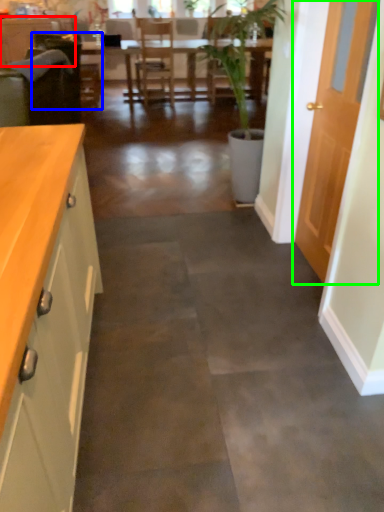
Question: Which is farther away from cabinetry (highlighted by a red box)? armchair (highlighted by a blue box) or door (highlighted by a green box)?

Choices:
 (A) armchair
 (B) door

Answer: (B)